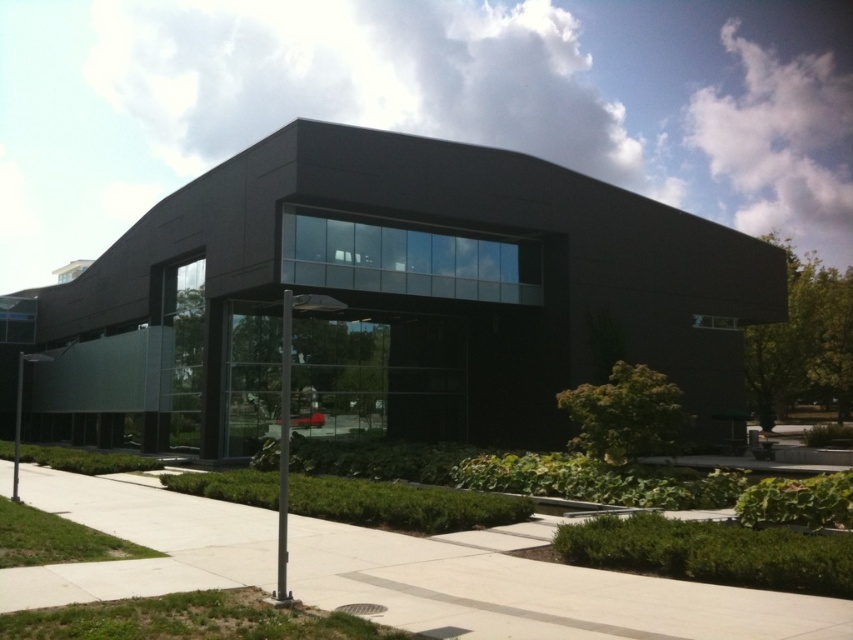
From the picture: Is concrete at center to the right of metallic pole at lower left from the viewer's perspective?

Indeed, concrete at center is positioned on the right side of metallic pole at lower left.

Is concrete at center shorter than metallic pole at lower left?

Yes, concrete at center is shorter than metallic pole at lower left.

Image resolution: width=853 pixels, height=640 pixels. Find the location of `concrete at center`. concrete at center is located at coordinates (532, 589).

Which of these two, matte black building at center or metallic pole at lower left, stands taller?

With more height is matte black building at center.

Is point (132, 403) in front of point (12, 497)?

No, (132, 403) is further to viewer.

Between point (519, 292) and point (15, 493), which one is positioned in front?

Point (15, 493) is more forward.

Find the location of a particular element. This screenshot has height=640, width=853. matte black building at center is located at coordinates (386, 301).

Is matte black building at center wider than concrete at center?

Yes, matte black building at center is wider than concrete at center.

Does matte black building at center have a smaller size compared to concrete at center?

No.

Identify the location of matte black building at center. This screenshot has height=640, width=853. (386, 301).